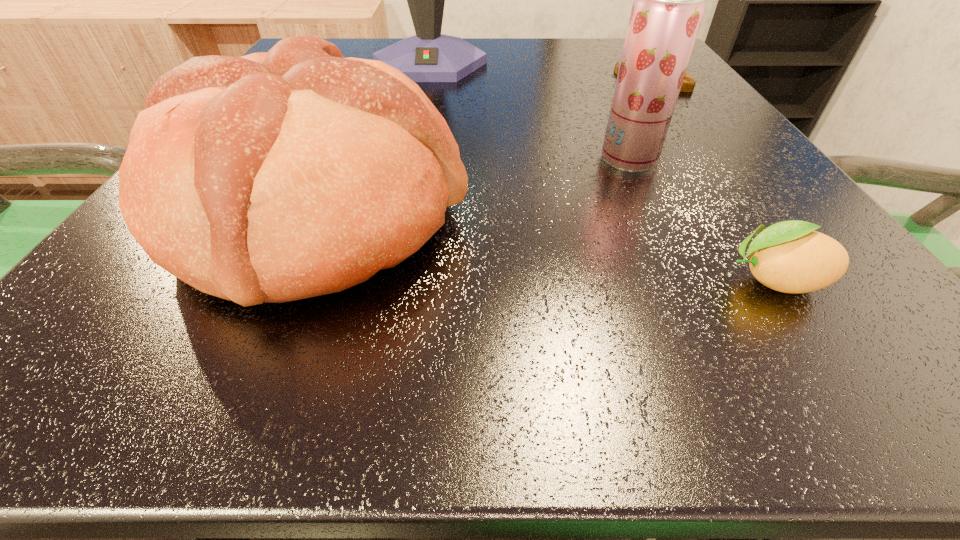
I want to click on object that is at the far left corner, so click(x=429, y=56).

Image resolution: width=960 pixels, height=540 pixels. What are the coordinates of `object at the near left corner` in the screenshot? It's located at (276, 176).

Where is `object that is at the far right corner`? object that is at the far right corner is located at coordinates (688, 84).

The width and height of the screenshot is (960, 540). What are the coordinates of `vacant region at the far edge of the desktop` in the screenshot? It's located at (395, 42).

Where is `vacant area at the near edge`? Image resolution: width=960 pixels, height=540 pixels. vacant area at the near edge is located at coordinates (706, 315).

In order to click on free region at the right edge of the desktop in this screenshot , I will do click(x=671, y=123).

Identify the location of free space at the near left corner of the desktop. (170, 386).

Locate an element on the screen. Image resolution: width=960 pixels, height=540 pixels. blank region between the shortest object and the figurine is located at coordinates (715, 180).

You are a GUI agent. You are given a task and a screenshot of the screen. Output one action in this format:
    pyautogui.click(x=<x>, y=<y>)
    Task: Click on the free space between the bread and the shortest object
    The height and width of the screenshot is (540, 960).
    Given the screenshot: What is the action you would take?
    pyautogui.click(x=546, y=247)

What are the coordinates of `vacant point located between the bread and the figurine` in the screenshot? It's located at (488, 147).